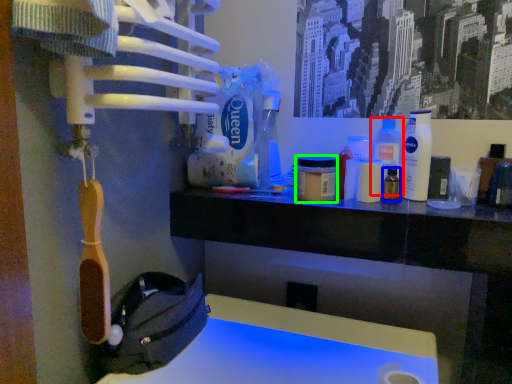
Question: Considering the real-world distances, which object is closest to cleaning product (highlighted by a red box)? bottle (highlighted by a blue box) or mouthwash (highlighted by a green box).

Choices:
 (A) bottle
 (B) mouthwash

Answer: (A)